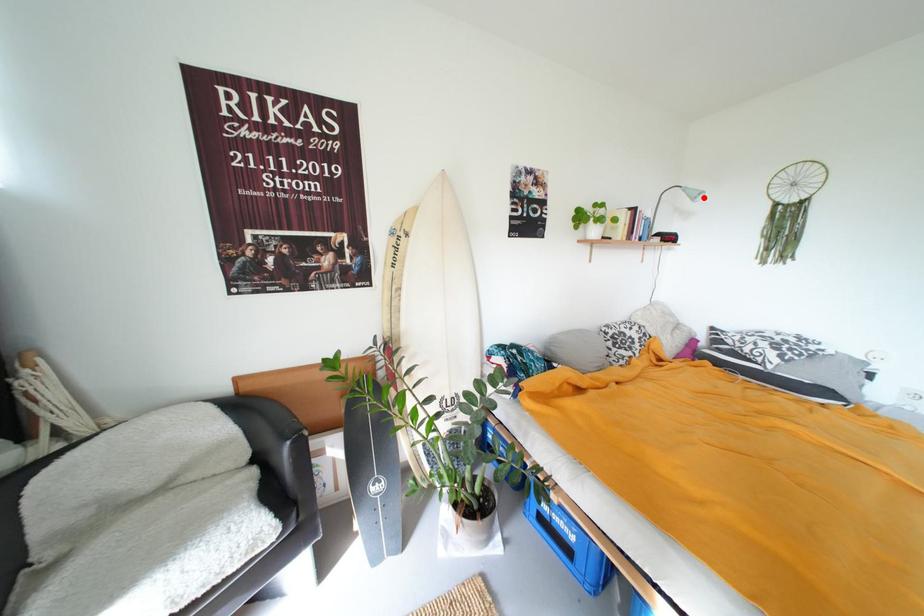
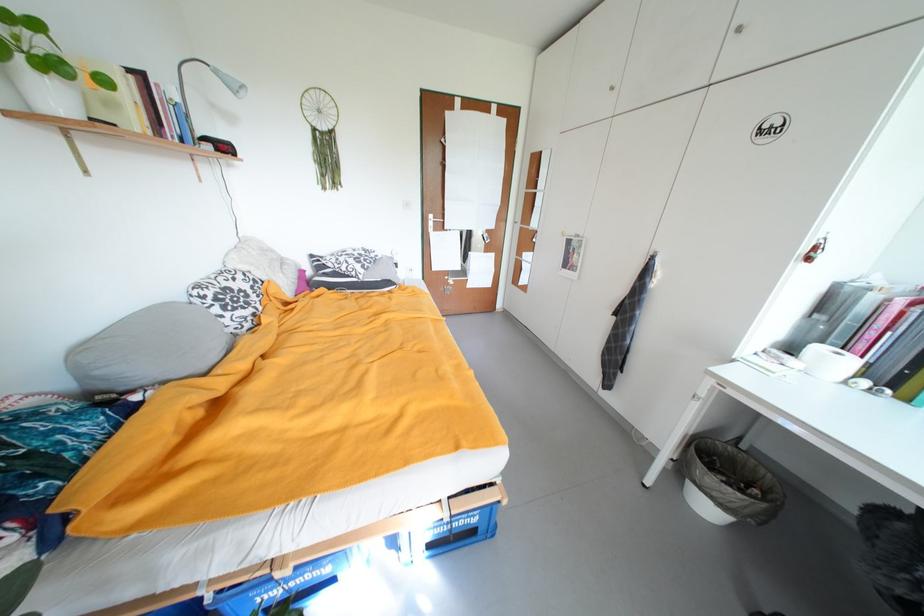
The point at the highlighted location is marked in the first image. Where is the corresponding point in the second image?

(244, 90)